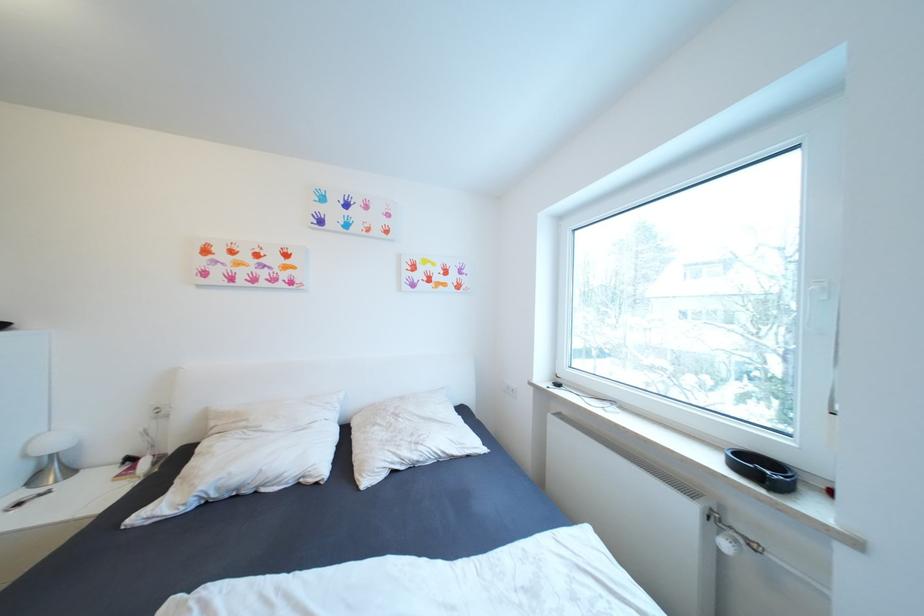
Find the location of a particular element. The image size is (924, 616). silver table lamp is located at coordinates (51, 456).